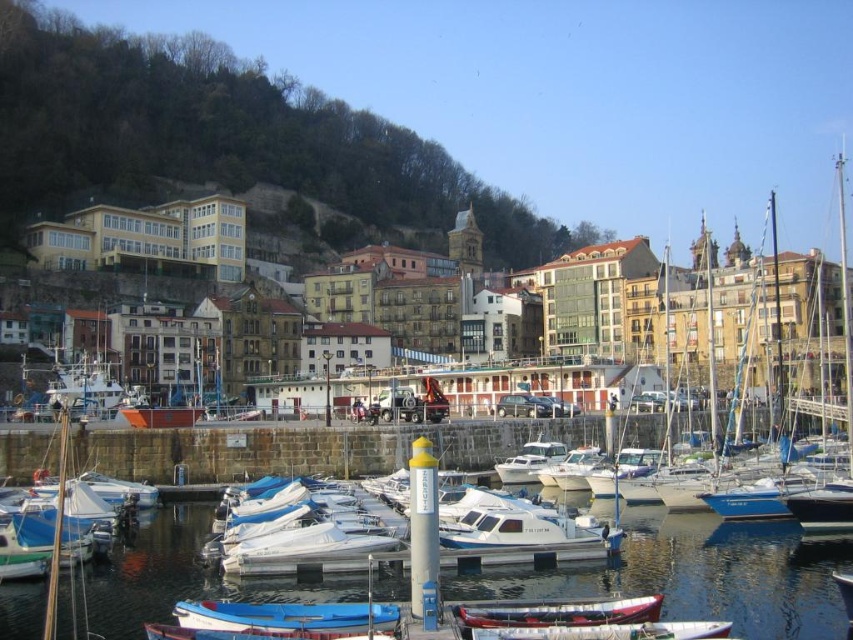
Does green leafy hillside at upper left have a lesser width compared to white plastic boat at center?

Incorrect, green leafy hillside at upper left's width is not less than white plastic boat at center's.

At what (x,y) coordinates should I click in order to perform the action: click on green leafy hillside at upper left. Please return your answer as a coordinate pair (x, y). This screenshot has height=640, width=853. Looking at the image, I should click on (219, 136).

In order to click on green leafy hillside at upper left in this screenshot , I will do `click(219, 136)`.

Between point (80, 122) and point (616, 616), which one is positioned in front?

Point (616, 616) is more forward.

Who is higher up, green leafy hillside at upper left or wooden canoe at center?

green leafy hillside at upper left

In order to click on green leafy hillside at upper left in this screenshot , I will do `click(219, 136)`.

Does point (817, 611) lie in front of point (720, 632)?

No, it is not.

Is white plastic boats at center wider than white plastic boat at center?

Indeed, white plastic boats at center has a greater width compared to white plastic boat at center.

Between point (9, 616) and point (527, 636), which one is positioned in front?

Point (527, 636)

At what (x,y) coordinates should I click in order to perform the action: click on white plastic boats at center. Please return your answer as a coordinate pair (x, y). The height and width of the screenshot is (640, 853). Looking at the image, I should click on (701, 573).